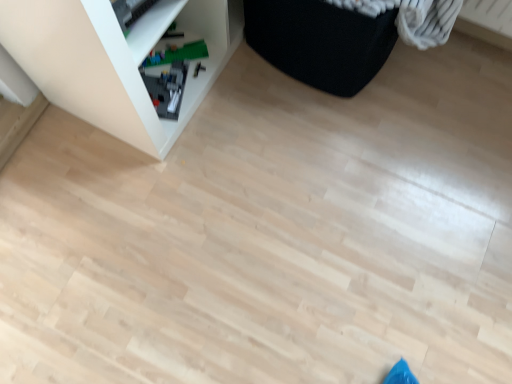
I want to click on vacant area in front of white plastic shelf at upper left, so coord(149,203).